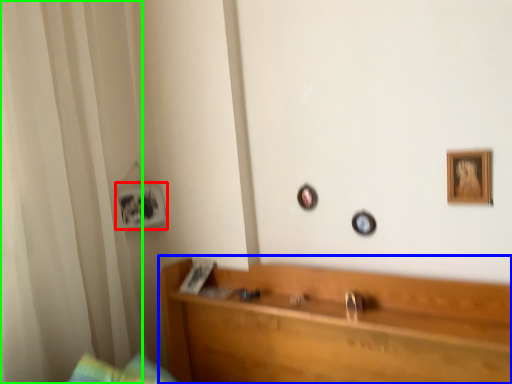
Question: Which is farther away from picture frame (highlighted by a red box)? furniture (highlighted by a blue box) or curtain (highlighted by a green box)?

Choices:
 (A) furniture
 (B) curtain

Answer: (A)